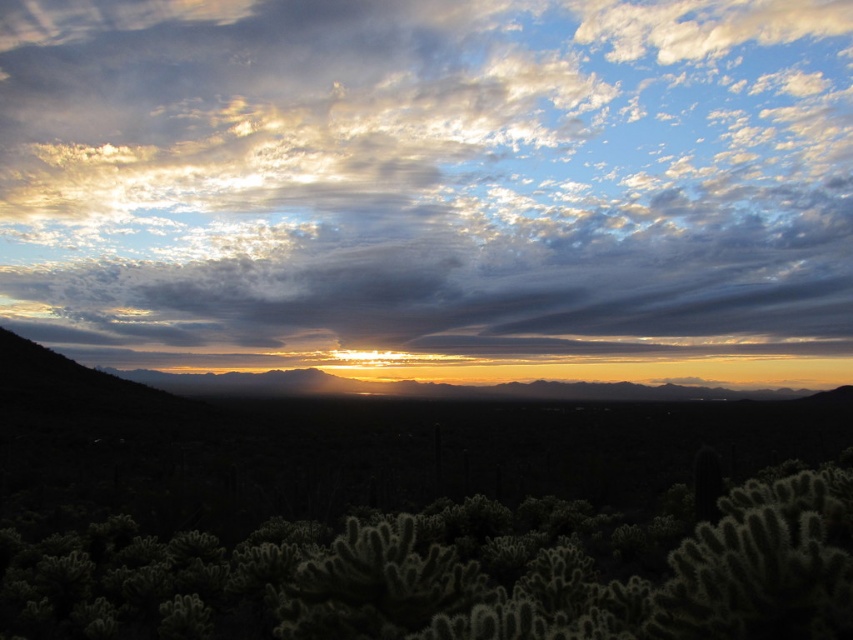
You are a photographer trying to capture the cloudy sky at upper center and the green spiky cactus at lower center in a single frame. Based on their positions, where should you position the cactus in your camera viewfinder relative to the sky?

The cloudy sky at upper center is located above the green spiky cactus at lower center, so you should position the cactus at the lower part of the viewfinder and the sky at the upper part to capture both in one frame.

You are standing at the origin point in the desert scene. There are two points marked in the image, point (842, 70) and point (495, 552). Which point is closer to you?

Point (495, 552) is closer to you because it is in front of point (842, 70).

You are a photographer standing at the lower center of the desert scene. You want to capture a photo that includes both the cloudy sky at upper center and the green spiky cactus at lower center. Given their distance apart, will you need to adjust your camera settings to ensure both are in focus?

The cloudy sky at upper center and green spiky cactus at lower center are 75.60 meters apart. To ensure both are in focus, you would need to adjust your camera settings, such as increasing the depth of field by using a smaller aperture or focusing at the hyperfocal distance.